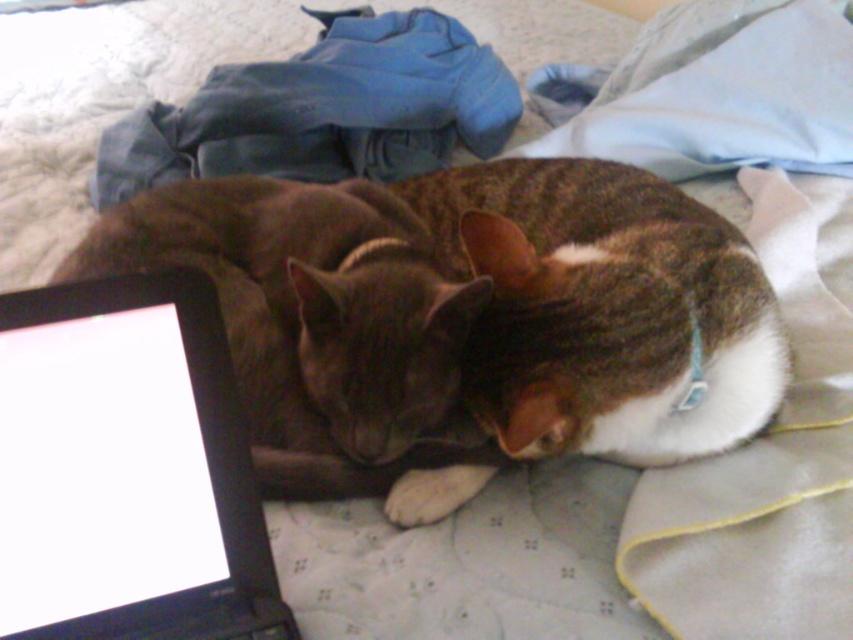
You are trying to locate a specific point in the image. The point is at coordinates point (x=126, y=468). Based on the scene description, which object is this point located on?

The point (x=126, y=468) is on the black plastic laptop at lower left.

You are a photographer trying to capture a closeup shot of the cats without disturbing them. You have a camera with a 12 inch lens extension. Can you get a clear closeup of the cats while keeping the black plastic laptop at lower left in focus?

The black plastic laptop at lower left is 18.24 inches from camera. Since your lens extension is 12 inches, you cannot reach the required distance to focus on the laptop while getting a closeup of the cats.